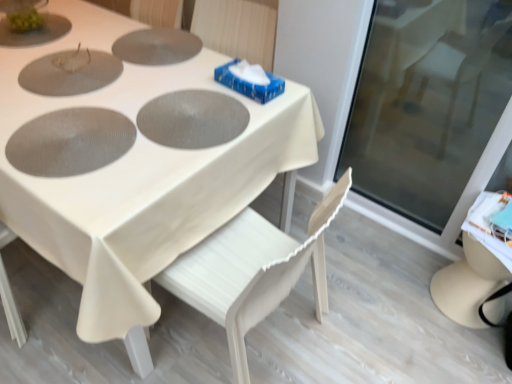
Where is `free point above matte gray pizza pan at center, which is counted as the 1th pizza pan, starting from the front (from a real-world perspective)`? The image size is (512, 384). free point above matte gray pizza pan at center, which is counted as the 1th pizza pan, starting from the front (from a real-world perspective) is located at coordinates (68, 129).